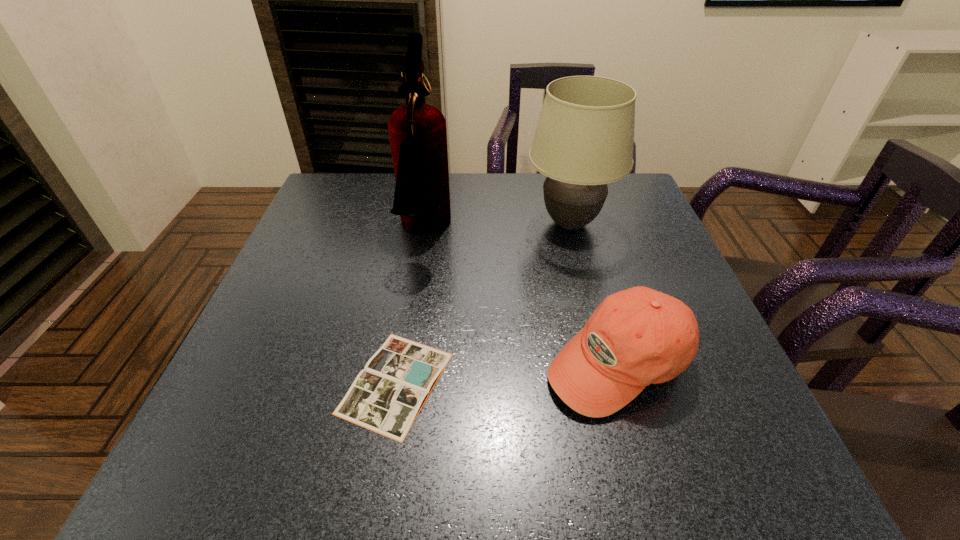
This screenshot has height=540, width=960. Find the location of `the tallest object`. the tallest object is located at coordinates (418, 137).

What are the coordinates of `lampshade` in the screenshot? It's located at (584, 139).

I want to click on the second shortest object, so click(636, 337).

You are a GUI agent. You are given a task and a screenshot of the screen. Output one action in this format:
    pyautogui.click(x=<x>, y=<y>)
    Task: Click on the book
    
    Given the screenshot: What is the action you would take?
    pyautogui.click(x=386, y=397)

Where is `free space located 0.370m at the nozzle of the fire extinguisher`? free space located 0.370m at the nozzle of the fire extinguisher is located at coordinates (602, 232).

Locate an element on the screen. This screenshot has height=540, width=960. free point located on the front of the third shortest object is located at coordinates pos(593,313).

I want to click on vacant point located 0.270m on the back of the baseball cap, so click(x=581, y=234).

Identify the location of vacant space situated 0.360m on the back of the shortest object. The height and width of the screenshot is (540, 960). (422, 224).

This screenshot has height=540, width=960. Identify the location of fire extinguisher positioned at the far edge. (418, 137).

This screenshot has width=960, height=540. In order to click on lampshade at the far edge in this screenshot , I will do `click(584, 139)`.